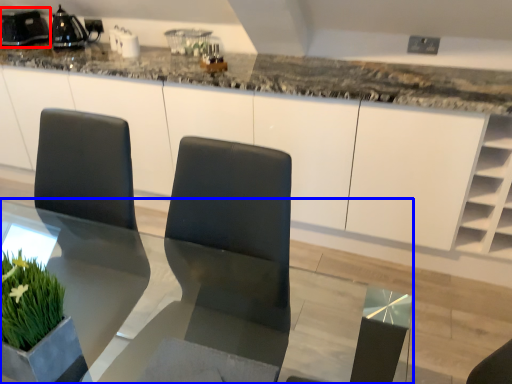
Question: Which point is further to the camera, appliance (highlighted by a red box) or table (highlighted by a blue box)?

Choices:
 (A) appliance
 (B) table

Answer: (A)